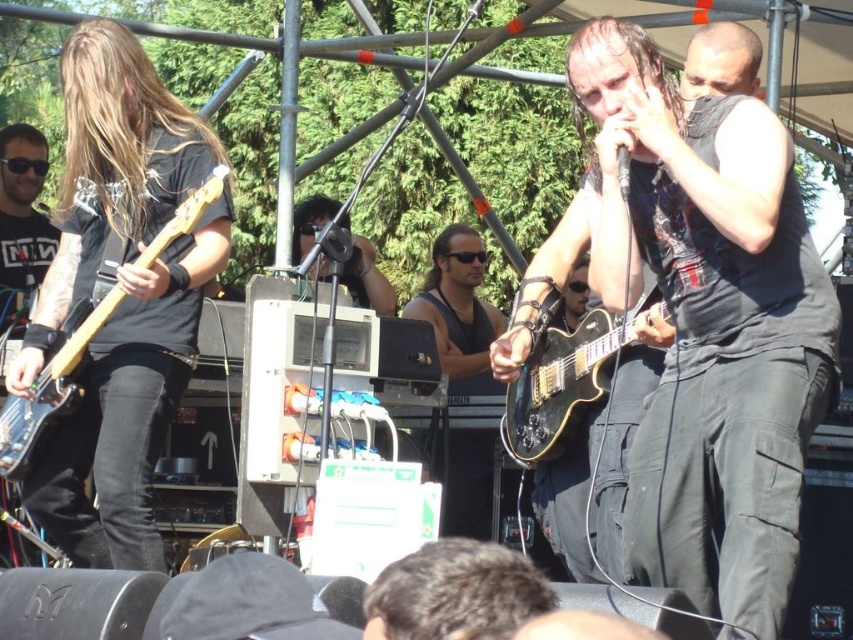
You are a photographer standing at the center of the stage during the live music performance. You want to take a photo that includes both the point at location (450, 339) and the point at (613, 371). Which point should you focus on first to ensure both are in sharp focus?

You should focus on point (450, 339) first because it is closer to the camera than point (613, 371). This ensures that both points will be in focus as the camera adjusts depth of field.

You are a photographer standing at the center of the stage. You want to take a photo of the black matte vest at right. Where should you point your camera relative to the center of the stage?

The black matte vest at right is located at coordinates 0.525 on the x axis and 0.838 on the y axis. To capture it, point your camera slightly to the right and upwards from the center of the stage.

You are a stagehand setting up a microphone stand. You need to place it between the black matte vest at right and the glossy black guitar at center. Can you fit the stand there?

The black matte vest at right is positioned over the glossy black guitar at center, meaning there is no space between them. Therefore, you cannot fit the microphone stand between them.